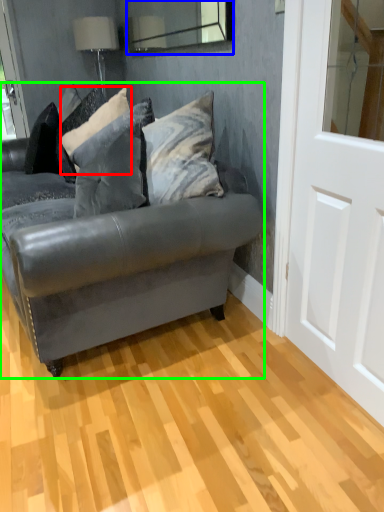
Question: Which object is positioned farthest from pillow (highlighted by a red box)? Select from mirror (highlighted by a blue box) and studio couch (highlighted by a green box).

Choices:
 (A) mirror
 (B) studio couch

Answer: (A)